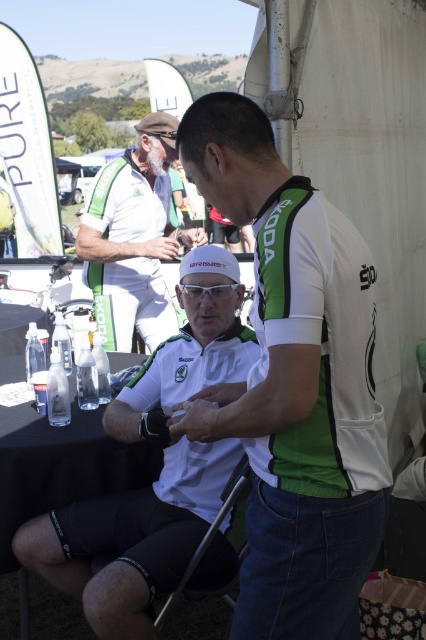
Question: Which of the following is the farthest from the observer?

Choices:
 (A) (80, 580)
 (B) (112, 220)
 (C) (92, 413)

Answer: (B)

Question: Is white matte cycling jersey at center closer to camera compared to white matte shirt at upper center?

Choices:
 (A) no
 (B) yes

Answer: (B)

Question: Which object is farther from the camera taking this photo?

Choices:
 (A) black fabric table at lower center
 (B) white matte cycling jersey at center

Answer: (A)

Question: Which point appears farthest from the camera in this image?

Choices:
 (A) (164, 244)
 (B) (16, 544)

Answer: (A)

Question: Is the position of white matte cycling jersey at center more distant than that of black fabric folding chair at lower center?

Choices:
 (A) no
 (B) yes

Answer: (A)

Question: Is white matte cycling jersey at center positioned at the back of black fabric table at lower center?

Choices:
 (A) yes
 (B) no

Answer: (B)